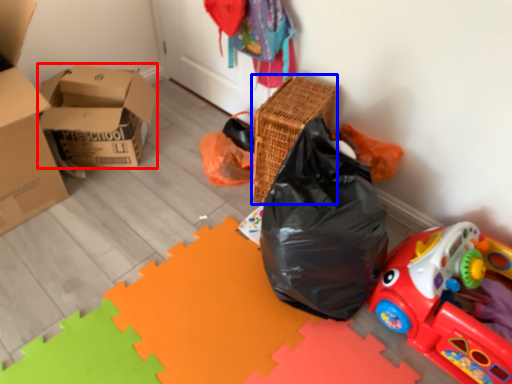
Question: Which object appears farthest to the camera in this image, box (highlighted by a red box) or basket (highlighted by a blue box)?

Choices:
 (A) box
 (B) basket

Answer: (A)